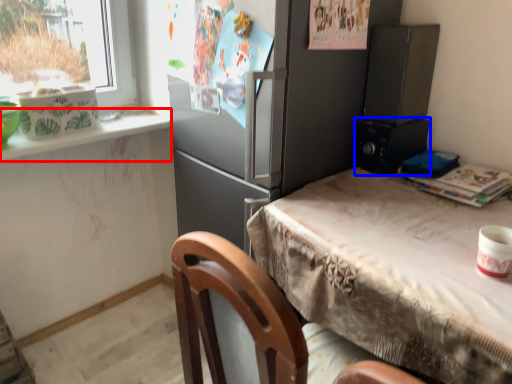
Question: Which object is further to the camera taking this photo, window sill (highlighted by a red box) or appliance (highlighted by a blue box)?

Choices:
 (A) window sill
 (B) appliance

Answer: (B)